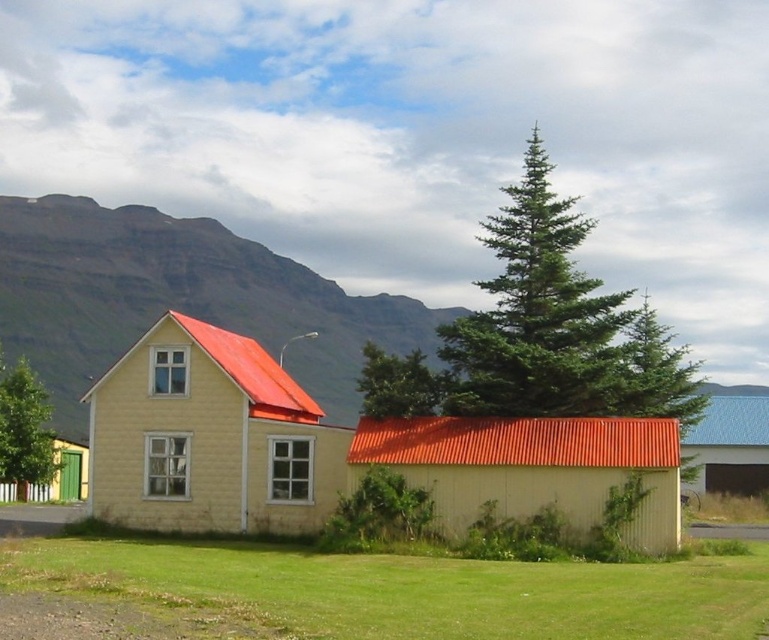
Does green leafy tree at left appear over green painted wooden door at lower left?

Correct, green leafy tree at left is located above green painted wooden door at lower left.

Does green leafy tree at left appear on the left side of green painted wooden door at lower left?

Correct, you'll find green leafy tree at left to the left of green painted wooden door at lower left.

Between point (25, 429) and point (82, 465), which one is positioned behind?

The point (82, 465) is behind.

Find the location of a particular element. The width and height of the screenshot is (769, 640). green leafy tree at left is located at coordinates (25, 428).

Is point (554, 484) positioned after point (428, 410)?

No, it is in front of (428, 410).

Between point (468, 451) and point (371, 410), which one is positioned in front?

Point (468, 451) is in front.

You are a GUI agent. You are given a task and a screenshot of the screen. Output one action in this format:
    pyautogui.click(x=<x>, y=<y>)
    Task: Click on the metallic corrugated hut at center
    
    Given the screenshot: What is the action you would take?
    pyautogui.click(x=531, y=468)

Image resolution: width=769 pixels, height=640 pixels. I want to click on metallic corrugated hut at center, so click(x=531, y=468).

Is rugged rock mountain at left wider than blue corrugated metal hut at right?

Yes.

Which of these two, rugged rock mountain at left or blue corrugated metal hut at right, stands shorter?

Standing shorter between the two is blue corrugated metal hut at right.

Which is in front, point (87, 260) or point (761, 470)?

Positioned in front is point (761, 470).

Locate an element on the screen. This screenshot has width=769, height=640. rugged rock mountain at left is located at coordinates (177, 298).